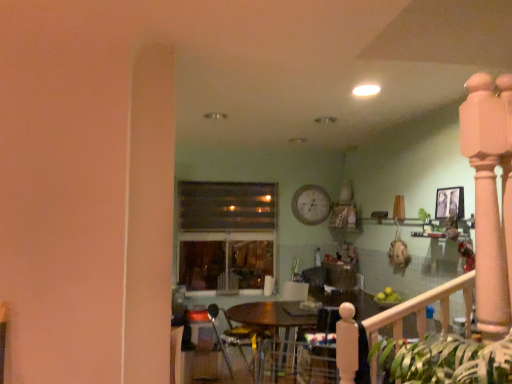
You are a GUI agent. You are given a task and a screenshot of the screen. Output one action in this format:
    pyautogui.click(x=<x>, y=<y>)
    Task: Click on the velvet dark blue armchair at center, the first armchair when ordered from right to left
    This screenshot has height=384, width=512.
    Given the screenshot: What is the action you would take?
    pyautogui.click(x=319, y=360)

How much space does velvet dark blue armchair at center, the second armchair positioned from the left, occupy vertically?

velvet dark blue armchair at center, the second armchair positioned from the left, is 27.24 inches tall.

Describe the element at coordinates (226, 234) in the screenshot. I see `transparent glass window at center` at that location.

You are a GUI agent. You are given a task and a screenshot of the screen. Output one action in this format:
    pyautogui.click(x=<x>, y=<y>)
    Task: Click on the metallic silver armchair at center, the 2th armchair positioned from the right
    Image resolution: width=512 pixels, height=384 pixels.
    Given the screenshot: What is the action you would take?
    pyautogui.click(x=234, y=339)

What is the approximate height of metallic silver armchair at center, the 2th armchair positioned from the right?

26.67 inches.

Find the location of a particular element. Image resolution: width=512 pixels, height=384 pixels. velvet dark blue armchair at center, the first armchair when ordered from right to left is located at coordinates (319, 360).

Who is smaller, white wooden clock at upper center or transparent glass window at center?

white wooden clock at upper center.

Could you tell me if white wooden clock at upper center is turned towards transparent glass window at center?

No, white wooden clock at upper center is not turned towards transparent glass window at center.

Is white wooden clock at upper center in contact with transparent glass window at center?

white wooden clock at upper center is not next to transparent glass window at center, and they're not touching.

Is white wooden clock at upper center closer to the viewer compared to transparent glass window at center?

No, the depth of white wooden clock at upper center is greater than that of transparent glass window at center.

Could you tell me if transparent glass window at center is facing wooden table at center?

Yes, transparent glass window at center is facing wooden table at center.

From a real-world perspective, is transparent glass window at center physically located above or below wooden table at center?

transparent glass window at center is above wooden table at center.

Can you tell me how much transparent glass window at center and wooden table at center differ in facing direction?

They differ by 88.2 degrees in their facing directions.

Find the location of a particular element. This screenshot has height=384, width=512. window located on the left of wooden table at center is located at coordinates (226, 234).

Based on the photo, which of these two, velvet dark blue armchair at center, the second armchair positioned from the left, or white wooden clock at upper center, stands shorter?

Standing shorter between the two is white wooden clock at upper center.

From the picture: From a real-world perspective, does velvet dark blue armchair at center, the second armchair positioned from the left, sit lower than white wooden clock at upper center?

Correct, in the physical world, velvet dark blue armchair at center, the second armchair positioned from the left, is lower than white wooden clock at upper center.

Is there a large distance between velvet dark blue armchair at center, the first armchair when ordered from right to left, and white wooden clock at upper center?

Yes.

Is point (362, 331) closer or farther from the camera than point (318, 193)?

Point (362, 331) appears to be closer to the viewer than point (318, 193).

Is transparent glass window at center looking in the opposite direction of velvet dark blue armchair at center, the second armchair positioned from the left?

transparent glass window at center is not turned away from velvet dark blue armchair at center, the second armchair positioned from the left.

Which is closer to the camera, (227, 194) or (358, 362)?

Point (227, 194) is positioned farther from the camera compared to point (358, 362).

From a real-world perspective, who is located lower, transparent glass window at center or velvet dark blue armchair at center, the second armchair positioned from the left?

velvet dark blue armchair at center, the second armchair positioned from the left, is physically lower.

Based on the photo, does transparent glass window at center have a greater height compared to velvet dark blue armchair at center, the second armchair positioned from the left?

Yes.

Does wooden table at center have a larger size compared to white wooden clock at upper center?

Yes.

Is wooden table at center completely or partially outside of white wooden clock at upper center?

wooden table at center is positioned outside white wooden clock at upper center.

Is wooden table at center wider or thinner than white wooden clock at upper center?

Clearly, wooden table at center has more width compared to white wooden clock at upper center.

Which is correct: white wooden clock at upper center is inside wooden table at center, or outside of it?

white wooden clock at upper center is not enclosed by wooden table at center.

From a real-world perspective, is white wooden clock at upper center positioned above or below wooden table at center?

white wooden clock at upper center is situated higher than wooden table at center in the real world.

In terms of height, does white wooden clock at upper center look taller or shorter compared to wooden table at center?

Considering their sizes, white wooden clock at upper center has less height than wooden table at center.

Is white wooden clock at upper center placed right next to wooden table at center?

white wooden clock at upper center and wooden table at center are not in contact.

Is point (348, 349) closer to viewer compared to point (266, 202)?

Yes, it is.

Is wooden table at center oriented towards transparent glass window at center?

No, wooden table at center is not facing towards transparent glass window at center.

Identify the location of window that appears on the left of white wooden clock at upper center. The image size is (512, 384). (226, 234).

This screenshot has height=384, width=512. What are the coordinates of `window lying behind the wooden table at center` in the screenshot? It's located at (226, 234).

Estimate the real-world distances between objects in this image. Which object is further from velvet dark blue armchair at center, the second armchair positioned from the left, metallic silver armchair at center, which ranks as the first armchair in left-to-right order, or white wooden clock at upper center?

white wooden clock at upper center.

Based on their spatial positions, is wooden table at center or velvet dark blue armchair at center, the second armchair positioned from the left, closer to transparent glass window at center?

Based on the image, velvet dark blue armchair at center, the second armchair positioned from the left, appears to be nearer to transparent glass window at center.

In the scene shown: When comparing their distances from metallic silver armchair at center, which ranks as the first armchair in left-to-right order, does white wooden clock at upper center or velvet dark blue armchair at center, the first armchair when ordered from right to left, seem further?

white wooden clock at upper center is further to metallic silver armchair at center, which ranks as the first armchair in left-to-right order.

Estimate the real-world distances between objects in this image. Which object is further from wooden table at center, white wooden clock at upper center or transparent glass window at center?

transparent glass window at center is further to wooden table at center.

Based on their spatial positions, is transparent glass window at center or metallic silver armchair at center, which ranks as the first armchair in left-to-right order, further from wooden table at center?

transparent glass window at center is positioned further to the anchor wooden table at center.

From the image, which object appears to be farther from white wooden clock at upper center, wooden table at center or transparent glass window at center?

The object further to white wooden clock at upper center is wooden table at center.

Which object lies nearer to the anchor point wooden table at center, metallic silver armchair at center, which ranks as the first armchair in left-to-right order, or white wooden clock at upper center?

metallic silver armchair at center, which ranks as the first armchair in left-to-right order, lies closer to wooden table at center than the other object.

Which object lies nearer to the anchor point white wooden clock at upper center, velvet dark blue armchair at center, the second armchair positioned from the left, or wooden table at center?

Based on the image, velvet dark blue armchair at center, the second armchair positioned from the left, appears to be nearer to white wooden clock at upper center.

This screenshot has height=384, width=512. I want to click on window between velvet dark blue armchair at center, the second armchair positioned from the left, and white wooden clock at upper center in the front-back direction, so click(x=226, y=234).

What are the coordinates of `porch between metallic silver armchair at center, which ranks as the first armchair in left-to-right order, and velvet dark blue armchair at center, the first armchair when ordered from right to left, in the horizontal direction` in the screenshot? It's located at (425, 307).

This screenshot has width=512, height=384. What are the coordinates of `window positioned between wooden table at center and white wooden clock at upper center from near to far` in the screenshot? It's located at [x=226, y=234].

At what (x,y) coordinates should I click in order to perform the action: click on porch located between velvet dark blue armchair at center, the first armchair when ordered from right to left, and transparent glass window at center in the depth direction. Please return your answer as a coordinate pair (x, y). The height and width of the screenshot is (384, 512). Looking at the image, I should click on (425, 307).